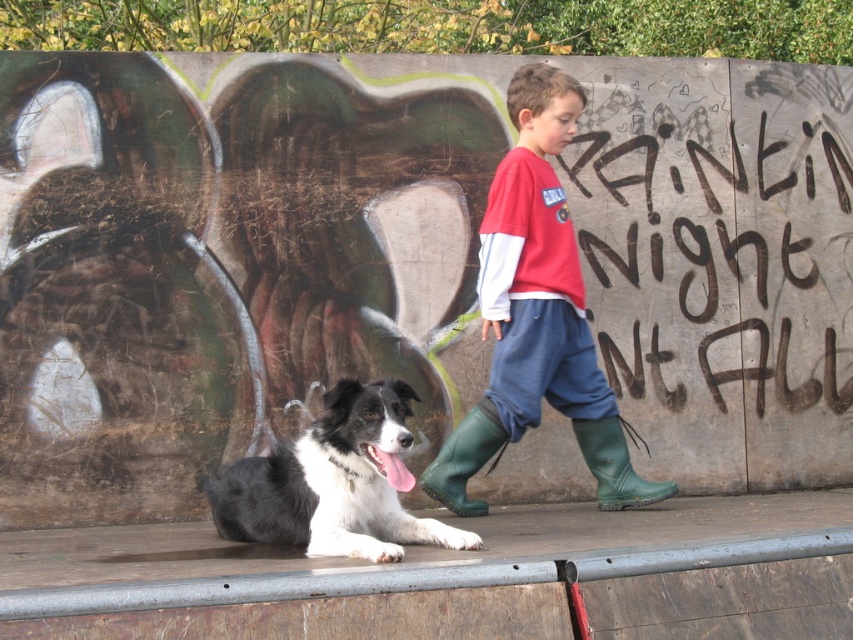
Consider the image. Can you confirm if black and white fur at lower left is wider than green rubber boot at lower center?

Yes.

Is point (332, 420) positioned behind point (460, 502)?

No, (332, 420) is in front of (460, 502).

Is point (236, 472) more distant than point (453, 477)?

No.

Locate an element on the screen. This screenshot has height=640, width=853. black and white fur at lower left is located at coordinates (334, 483).

Who is higher up, matte red shirt at center or green rubber boot at lower right?

Positioned higher is matte red shirt at center.

Which is more to the left, matte red shirt at center or green rubber boot at lower right?

matte red shirt at center is more to the left.

Which is in front, point (459, 513) or point (612, 451)?

Positioned in front is point (459, 513).

The width and height of the screenshot is (853, 640). Identify the location of matte red shirt at center. (537, 314).

What do you see at coordinates (537, 314) in the screenshot? The image size is (853, 640). I see `matte red shirt at center` at bounding box center [537, 314].

Who is higher up, matte red shirt at center or black and white fur at lower left?

Positioned higher is matte red shirt at center.

Between point (581, 396) and point (367, 515), which one is positioned in front?

Point (367, 515) is more forward.

Find the location of a particular element. The width and height of the screenshot is (853, 640). matte red shirt at center is located at coordinates (537, 314).